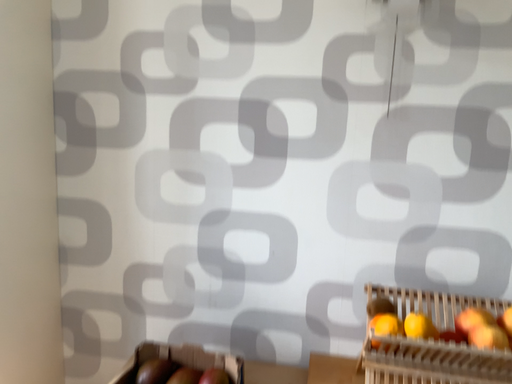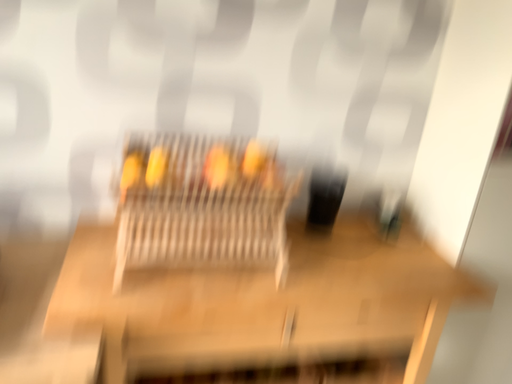
Question: Which way did the camera rotate in the video?

Choices:
 (A) rotated upward
 (B) rotated downward

Answer: (B)